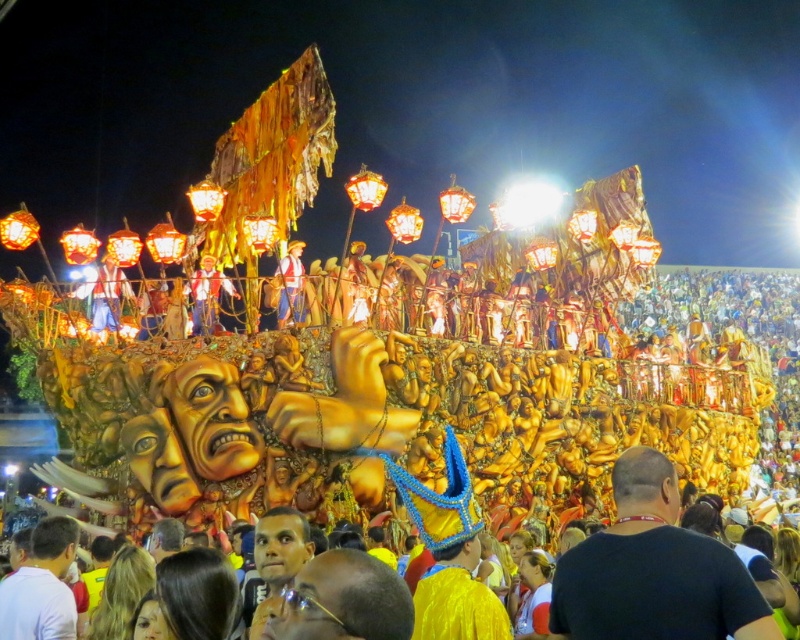
Is matte gold figure at upper center to the right of matte blue jeans at center from the viewer's perspective?

In fact, matte gold figure at upper center is to the left of matte blue jeans at center.

Does point (202, 326) come farther from viewer compared to point (286, 269)?

No, (202, 326) is closer to viewer.

Find the location of a particular element. The width and height of the screenshot is (800, 640). matte gold figure at upper center is located at coordinates (208, 296).

Can you confirm if black matte shirt at center is thinner than matte gold statue at center?

No.

The height and width of the screenshot is (640, 800). I want to click on black matte shirt at center, so click(654, 570).

Can you confirm if black matte shirt at center is positioned below matte blue jeans at center?

Yes, black matte shirt at center is below matte blue jeans at center.

Can you confirm if black matte shirt at center is smaller than matte blue jeans at center?

Yes, black matte shirt at center is smaller than matte blue jeans at center.

You are a GUI agent. You are given a task and a screenshot of the screen. Output one action in this format:
    pyautogui.click(x=<x>, y=<y>)
    Task: Click on the black matte shirt at center
    This screenshot has height=640, width=800.
    Given the screenshot: What is the action you would take?
    pyautogui.click(x=654, y=570)